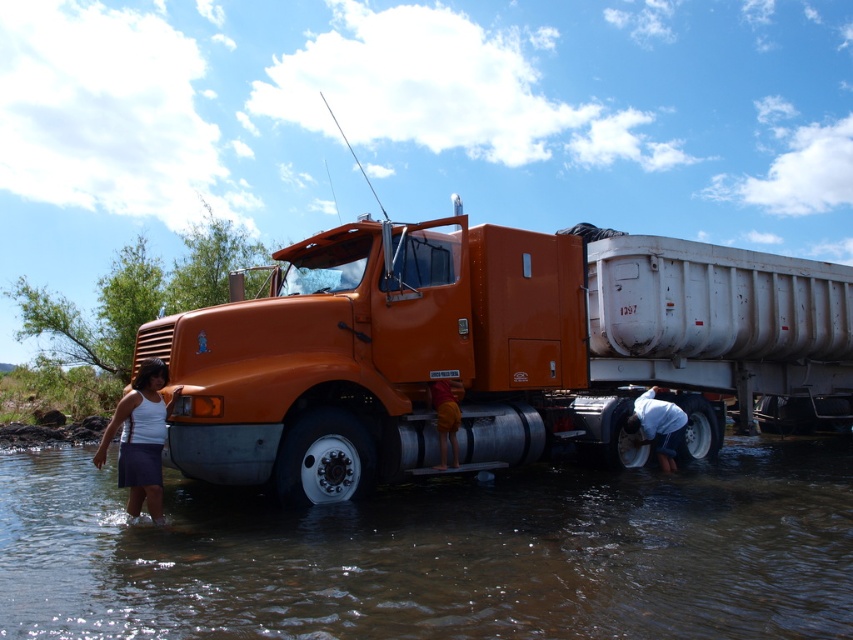
Is orange matte truck at center thinner than white fabric skirt at lower left?

Incorrect, orange matte truck at center's width is not less than white fabric skirt at lower left's.

Is point (570, 278) less distant than point (144, 397)?

No, (570, 278) is behind (144, 397).

Find the location of `orange matte truck at center`. orange matte truck at center is located at coordinates (485, 349).

Who is shorter, white fabric skirt at lower left or orange fabric pants at lower center?

Standing shorter between the two is orange fabric pants at lower center.

Find the location of a particular element. The width and height of the screenshot is (853, 640). white fabric skirt at lower left is located at coordinates (140, 436).

The image size is (853, 640). What do you see at coordinates (440, 554) in the screenshot? I see `brown muddy water at lower center` at bounding box center [440, 554].

Between brown muddy water at lower center and white cotton shirt at lower right, which one appears on the right side from the viewer's perspective?

white cotton shirt at lower right

Is point (544, 504) in front of point (660, 442)?

Yes, point (544, 504) is closer to viewer.

Identify the location of brown muddy water at lower center. This screenshot has height=640, width=853. (440, 554).